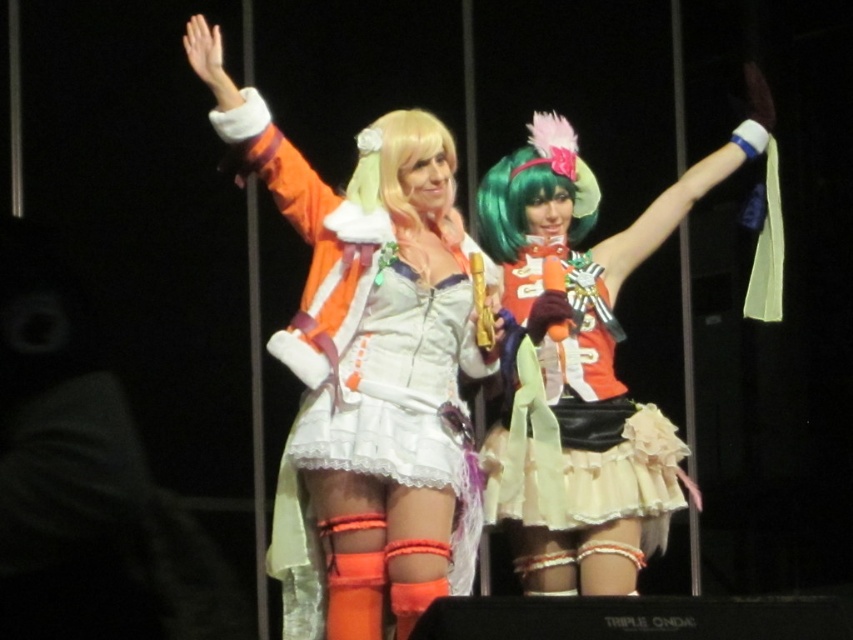
You are a photographer at a cosplay event and need to capture a clear shot of both the shiny green wig at center and the blonde wig at center. From your current position, which wig should you focus on first to ensure both are in frame?

The shiny green wig at center is positioned on the right side of the blonde wig at center, so you should focus on the blonde wig at center first to ensure both are in frame.

You are a photographer setting up for a cosplay photoshoot. You need to ensure that the orange satin skirt at center and the blonde wig at center are both visible in the frame. Given their positions and sizes, which object will appear taller in the photo?

The orange satin skirt at center appears taller than the blonde wig at center in the photo because the orange satin skirt at center has a greater height compared to the blonde wig at center.